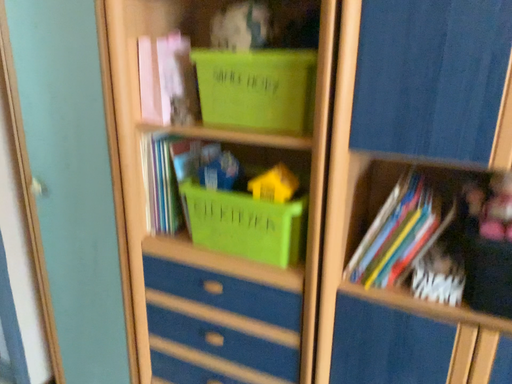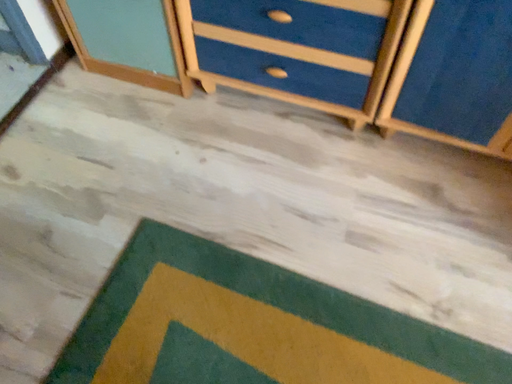
Question: Which way did the camera rotate in the video?

Choices:
 (A) rotated downward
 (B) rotated upward

Answer: (A)